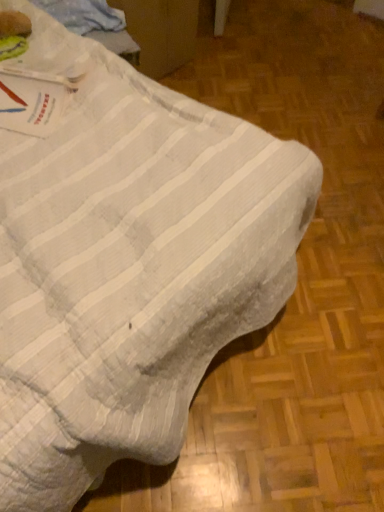
At what (x,y) coordinates should I click in order to perform the action: click on white fabric-covered box at upper left. Please return your answer as a coordinate pair (x, y). Looking at the image, I should click on (161, 32).

The height and width of the screenshot is (512, 384). What do you see at coordinates (161, 32) in the screenshot? I see `white fabric-covered box at upper left` at bounding box center [161, 32].

Where is `white fabric-covered box at upper left`? white fabric-covered box at upper left is located at coordinates (161, 32).